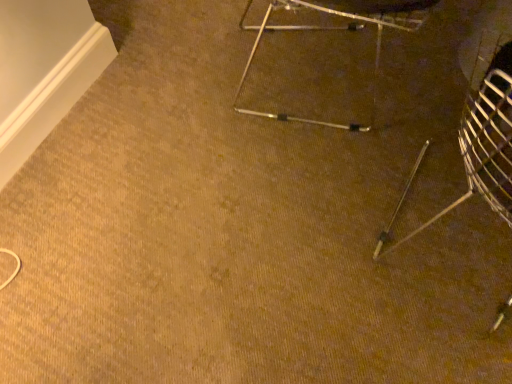
This screenshot has height=384, width=512. What do you see at coordinates (326, 30) in the screenshot? I see `metallic silver tripod at center` at bounding box center [326, 30].

Measure the distance between metallic silver tripod at center and camera.

The depth of metallic silver tripod at center is 4.37 feet.

The width and height of the screenshot is (512, 384). In order to click on metallic silver tripod at center in this screenshot , I will do `click(326, 30)`.

Find the location of a particular element. metallic silver tripod at center is located at coordinates (326, 30).